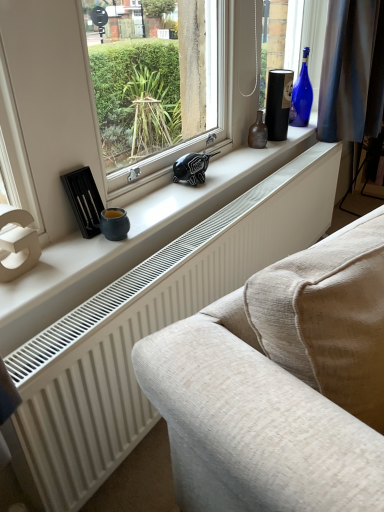
Question: In the image, is blue glass bottle at upper right, the 2th bottle from the left, on the left side or the right side of white textured radiator at lower center?

Choices:
 (A) right
 (B) left

Answer: (A)

Question: From a real-world perspective, is blue glass bottle at upper right, the 1th bottle in the back-to-front sequence, positioned above or below white textured radiator at lower center?

Choices:
 (A) below
 (B) above

Answer: (B)

Question: Which of these objects is positioned closest to the white textured radiator at lower center?

Choices:
 (A) blue glass bottle at upper right, the 2th bottle from the left
 (B) brown glass bottle at center, the first bottle from the front
 (C) white matte window sill at center

Answer: (C)

Question: Based on their relative distances, which object is nearer to the brown glass bottle at center, positioned as the second bottle in right-to-left order?

Choices:
 (A) white matte window sill at center
 (B) white textured radiator at lower center
 (C) blue glass bottle at upper right, which ranks as the 1th bottle in right-to-left order

Answer: (C)